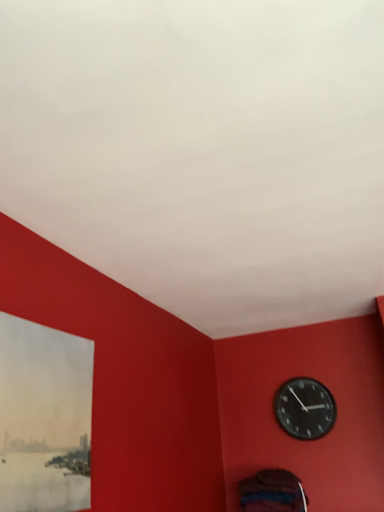
Image resolution: width=384 pixels, height=512 pixels. What do you see at coordinates (44, 417) in the screenshot?
I see `matte paper picture frame at lower left` at bounding box center [44, 417].

I want to click on matte paper picture frame at lower left, so click(x=44, y=417).

Describe the element at coordinates (304, 408) in the screenshot. The height and width of the screenshot is (512, 384). I see `black matte wall clock at upper right` at that location.

Find the location of a particular element. Image resolution: width=384 pixels, height=512 pixels. black matte wall clock at upper right is located at coordinates (304, 408).

At what (x,y) coordinates should I click in order to perform the action: click on matte paper picture frame at lower left. Please return your answer as a coordinate pair (x, y). The image size is (384, 512). Looking at the image, I should click on (44, 417).

Which object is positioned more to the left, matte paper picture frame at lower left or black matte wall clock at upper right?

matte paper picture frame at lower left is more to the left.

Does matte paper picture frame at lower left lie in front of black matte wall clock at upper right?

Yes, it is in front of black matte wall clock at upper right.

Is point (70, 400) closer or farther from the camera than point (315, 410)?

Clearly, point (70, 400) is closer to the camera than point (315, 410).

From the image's perspective, which is above, matte paper picture frame at lower left or black matte wall clock at upper right?

matte paper picture frame at lower left appears higher in the image.

From a real-world perspective, who is located lower, matte paper picture frame at lower left or black matte wall clock at upper right?

matte paper picture frame at lower left is physically lower.

Considering the sizes of objects matte paper picture frame at lower left and black matte wall clock at upper right in the image provided, who is wider, matte paper picture frame at lower left or black matte wall clock at upper right?

black matte wall clock at upper right is wider.

Which of these two, matte paper picture frame at lower left or black matte wall clock at upper right, stands taller?

Standing taller between the two is matte paper picture frame at lower left.

Based on their sizes in the image, would you say matte paper picture frame at lower left is bigger or smaller than black matte wall clock at upper right?

In the image, matte paper picture frame at lower left appears to be larger than black matte wall clock at upper right.

Is matte paper picture frame at lower left located outside black matte wall clock at upper right?

Absolutely, matte paper picture frame at lower left is external to black matte wall clock at upper right.

Would you say matte paper picture frame at lower left is a long distance from black matte wall clock at upper right?

Yes, matte paper picture frame at lower left and black matte wall clock at upper right are located far from each other.

Is matte paper picture frame at lower left looking in the opposite direction of black matte wall clock at upper right?

No, matte paper picture frame at lower left is not facing the opposite direction of black matte wall clock at upper right.

Locate an element on the screen. This screenshot has height=512, width=384. wall clock behind the matte paper picture frame at lower left is located at coordinates (304, 408).

Considering the relative positions of black matte wall clock at upper right and matte paper picture frame at lower left in the image provided, is black matte wall clock at upper right to the left or to the right of matte paper picture frame at lower left?

black matte wall clock at upper right is positioned on matte paper picture frame at lower left's right side.

Between black matte wall clock at upper right and matte paper picture frame at lower left, which one is positioned behind?

Positioned behind is black matte wall clock at upper right.

Considering the positions of point (303, 383) and point (83, 340), is point (303, 383) closer or farther from the camera than point (83, 340)?

Clearly, point (303, 383) is more distant from the camera than point (83, 340).

From the image's perspective, is black matte wall clock at upper right above or below matte paper picture frame at lower left?

black matte wall clock at upper right is below matte paper picture frame at lower left.

From a real-world perspective, is black matte wall clock at upper right physically above matte paper picture frame at lower left?

Indeed, from a real-world perspective, black matte wall clock at upper right stands above matte paper picture frame at lower left.

Considering the relative sizes of black matte wall clock at upper right and matte paper picture frame at lower left in the image provided, is black matte wall clock at upper right thinner than matte paper picture frame at lower left?

No.

Who is shorter, black matte wall clock at upper right or matte paper picture frame at lower left?

black matte wall clock at upper right.

Can you confirm if black matte wall clock at upper right is smaller than matte paper picture frame at lower left?

Indeed, black matte wall clock at upper right has a smaller size compared to matte paper picture frame at lower left.

Is matte paper picture frame at lower left a part of black matte wall clock at upper right?

Actually, matte paper picture frame at lower left is outside black matte wall clock at upper right.

Is the surface of black matte wall clock at upper right in direct contact with matte paper picture frame at lower left?

black matte wall clock at upper right and matte paper picture frame at lower left are not in contact.

Is black matte wall clock at upper right facing towards matte paper picture frame at lower left?

Yes.

Locate an element on the screen. The image size is (384, 512). picture frame in front of the black matte wall clock at upper right is located at coordinates (44, 417).

In the image, there is a matte paper picture frame at lower left. Where is `wall clock below it (from the image's perspective)`? wall clock below it (from the image's perspective) is located at coordinates (304, 408).

I want to click on picture frame below the black matte wall clock at upper right (from a real-world perspective), so click(x=44, y=417).